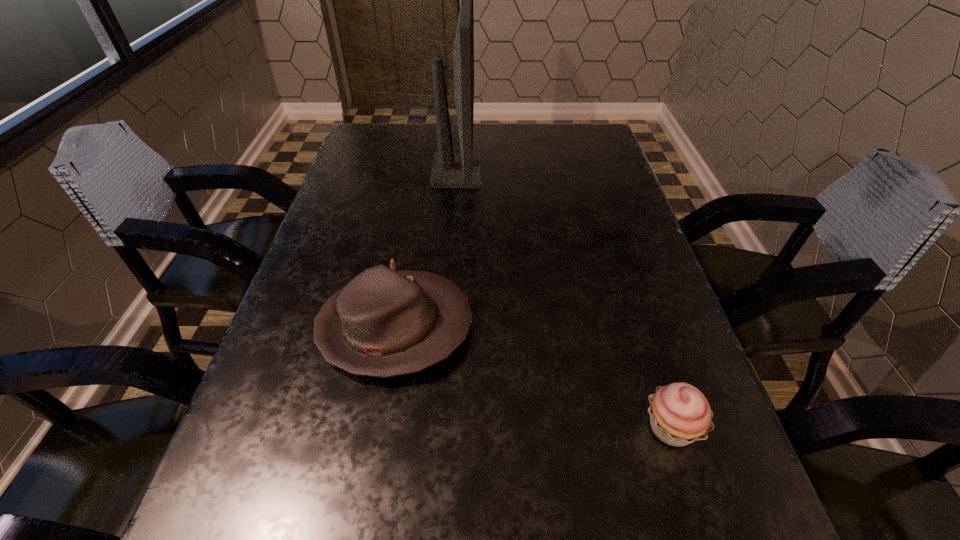
Locate an element on the screen. The height and width of the screenshot is (540, 960). computer monitor is located at coordinates (449, 170).

Find the location of a particular element. The image size is (960, 540). the farthest object is located at coordinates (449, 170).

Locate an element on the screen. hat is located at coordinates (383, 323).

Where is `the rightmost object`? The image size is (960, 540). the rightmost object is located at coordinates (680, 414).

I want to click on cupcake, so click(x=680, y=414).

Where is `vacant point located on the front-facing side of the computer monitor`? vacant point located on the front-facing side of the computer monitor is located at coordinates (542, 173).

The height and width of the screenshot is (540, 960). I want to click on vacant space situated on the decorative side of the second farthest object, so click(653, 328).

The width and height of the screenshot is (960, 540). Find the location of `free space located 0.090m on the front of the cupcake`. free space located 0.090m on the front of the cupcake is located at coordinates (702, 525).

The height and width of the screenshot is (540, 960). What are the coordinates of `object located at the far edge` in the screenshot? It's located at (449, 170).

Where is `object that is positioned at the left edge`? This screenshot has height=540, width=960. object that is positioned at the left edge is located at coordinates (383, 323).